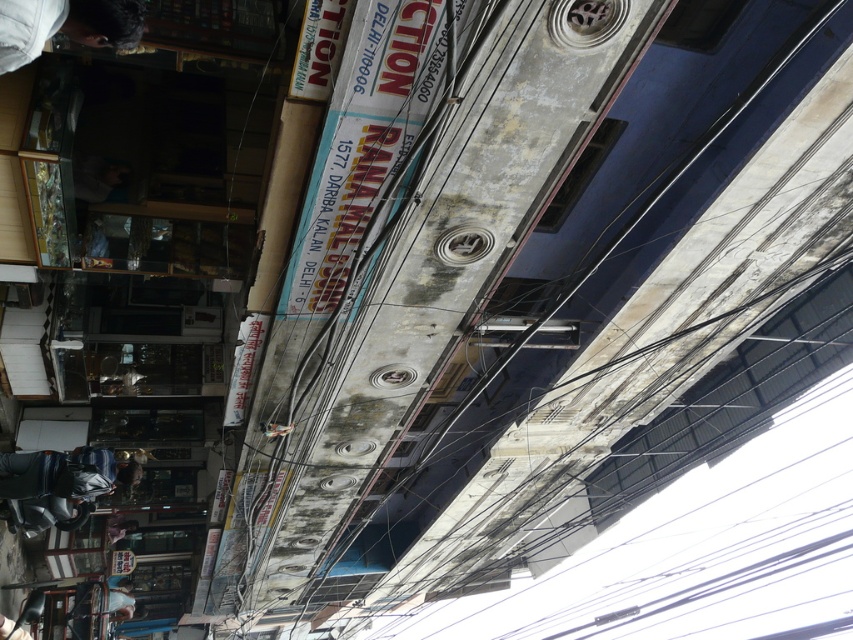
Is point (12, 26) closer to viewer compared to point (80, 467)?

Yes, it is in front of point (80, 467).

Which of these two, dark hair at upper left or metallic helmet at lower left, stands shorter?

Standing shorter between the two is dark hair at upper left.

Who is more distant from viewer, (82, 33) or (105, 474)?

Positioned behind is point (105, 474).

What are the coordinates of `dark hair at upper left` in the screenshot? It's located at (65, 26).